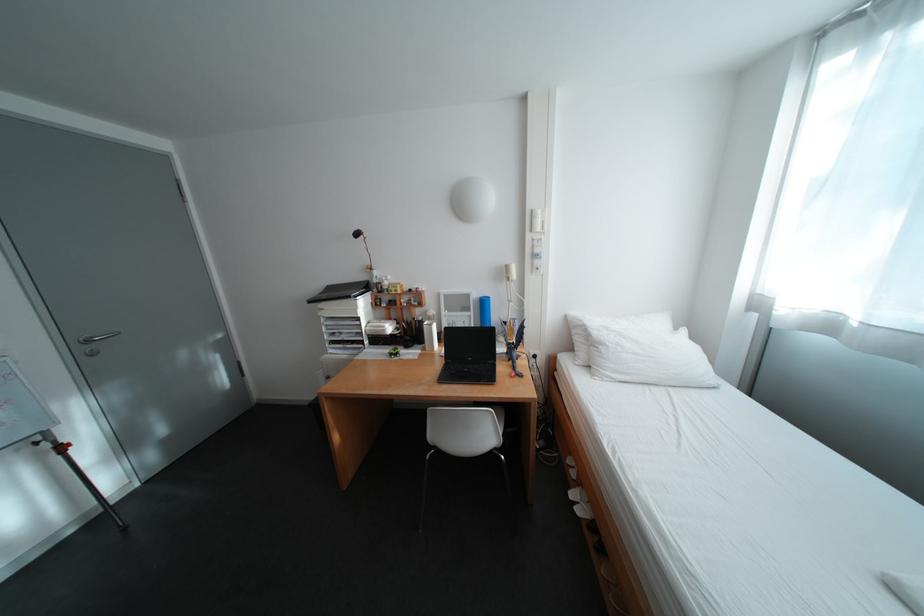
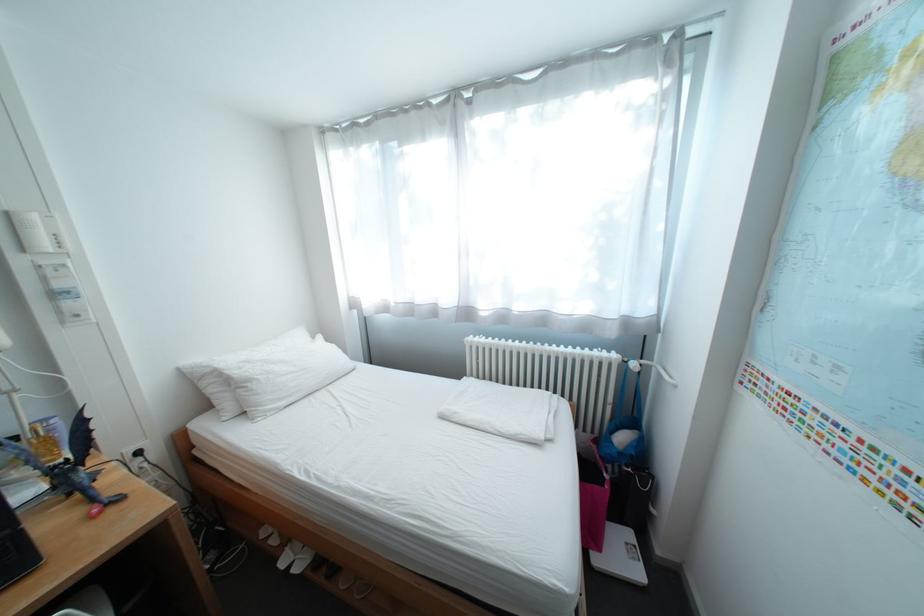
Question: The camera is either moving clockwise (left) or counter-clockwise (right) around the object. The first image is from the beginning of the video and the second image is from the end. Is the camera moving left or right when shooting the video?

Choices:
 (A) Left
 (B) Right

Answer: (A)